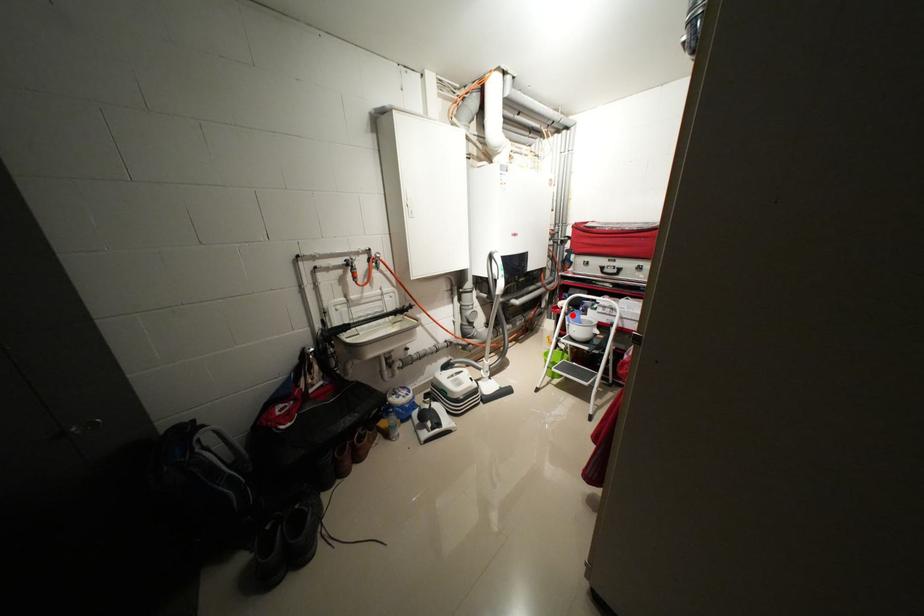
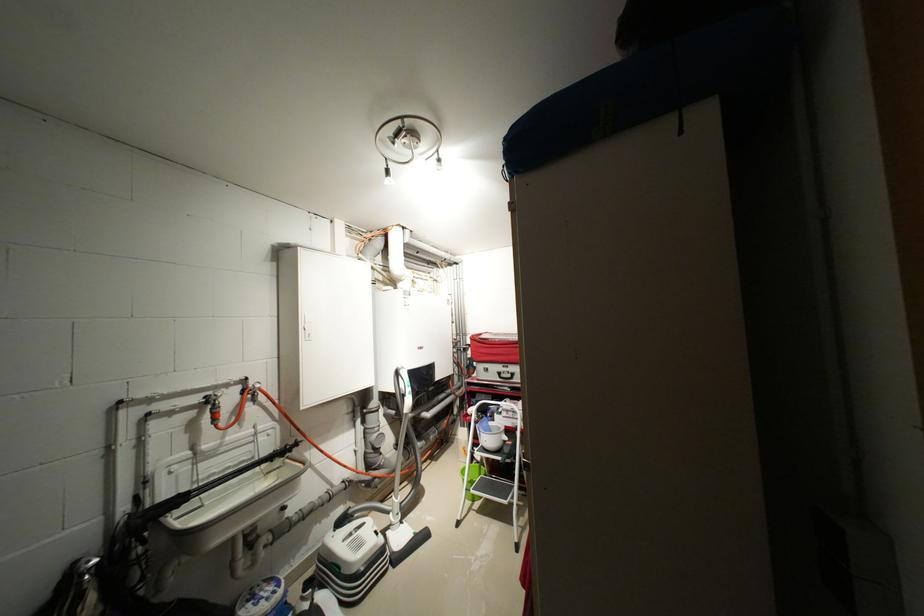
Question: I am providing you with two images of the same scene from different viewpoints. In image1, a red point is highlighted. Considering the same 3D point in image2, which of the following is correct?

Choices:
 (A) It is closer
 (B) It is farther

Answer: (B)